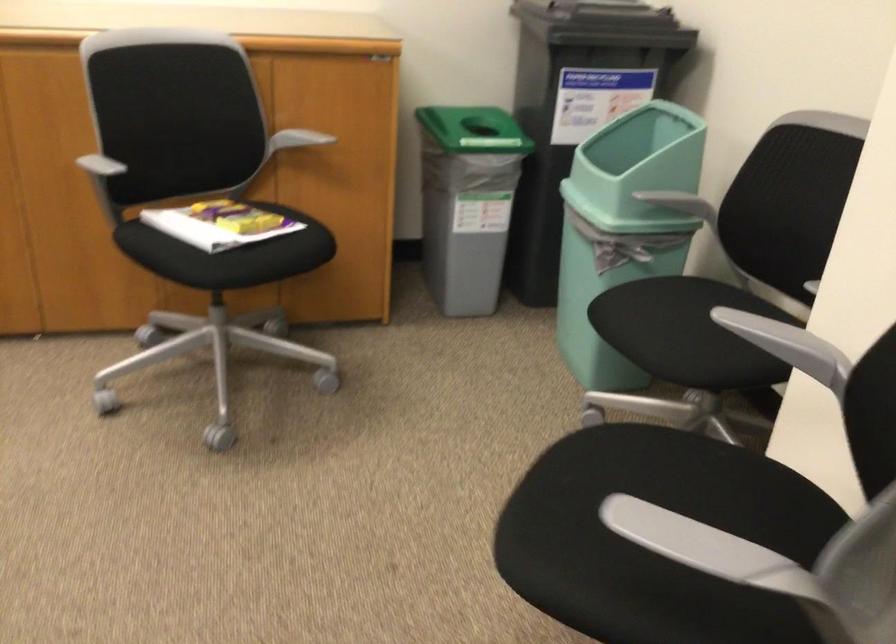
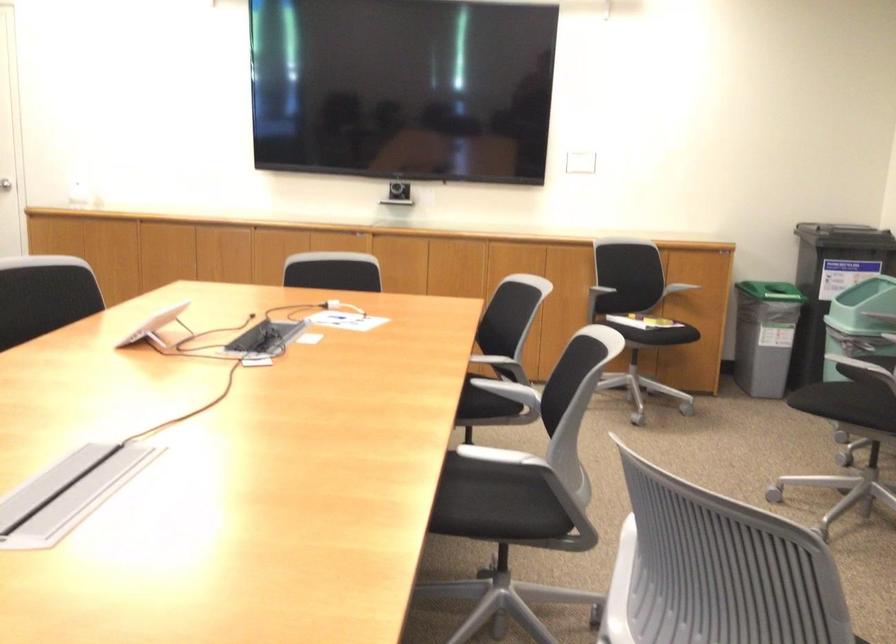
The point at (73, 196) is marked in the first image. Where is the corresponding point in the second image?

(571, 290)